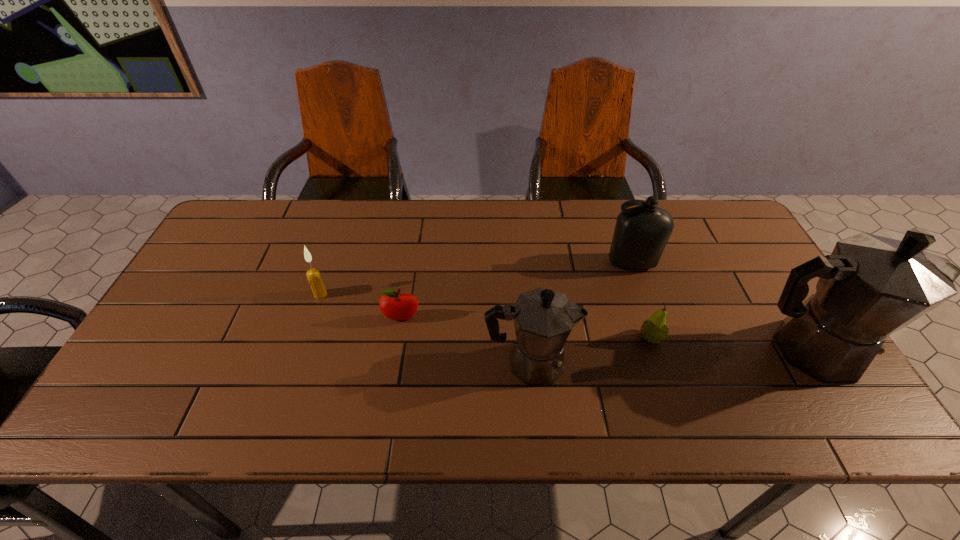
Find the location of `free space between the left coffeepot and the pear`. free space between the left coffeepot and the pear is located at coordinates (590, 350).

At what (x,y) coordinates should I click in order to perform the action: click on free spot between the farthest object and the taller coffeepot. Please return your answer as a coordinate pair (x, y). The height and width of the screenshot is (540, 960). Looking at the image, I should click on (720, 307).

Identify the location of unoccupied position between the bottle and the tallest object. [x=720, y=307].

This screenshot has height=540, width=960. I want to click on free space between the right coffeepot and the farthest object, so click(720, 307).

Identify the location of vacant region between the apple and the candle. (361, 307).

The image size is (960, 540). In order to click on vacant region between the apple and the bottle in this screenshot , I will do `click(516, 291)`.

Image resolution: width=960 pixels, height=540 pixels. In order to click on unoccupied area between the candle and the third object from left to right in this screenshot , I will do `click(425, 329)`.

Where is `the fourth closest object relative to the taller coffeepot`? The height and width of the screenshot is (540, 960). the fourth closest object relative to the taller coffeepot is located at coordinates (395, 306).

Locate an element on the screen. The height and width of the screenshot is (540, 960). object that stands as the closest to the third shortest object is located at coordinates click(395, 306).

At what (x,y) coordinates should I click in order to perform the action: click on free point that satisfies the following two spatial constraints: 1. on the front side of the farthest object; 2. on the pouring side of the left coffeepot. Please return your answer as a coordinate pair (x, y). Looking at the image, I should click on (665, 363).